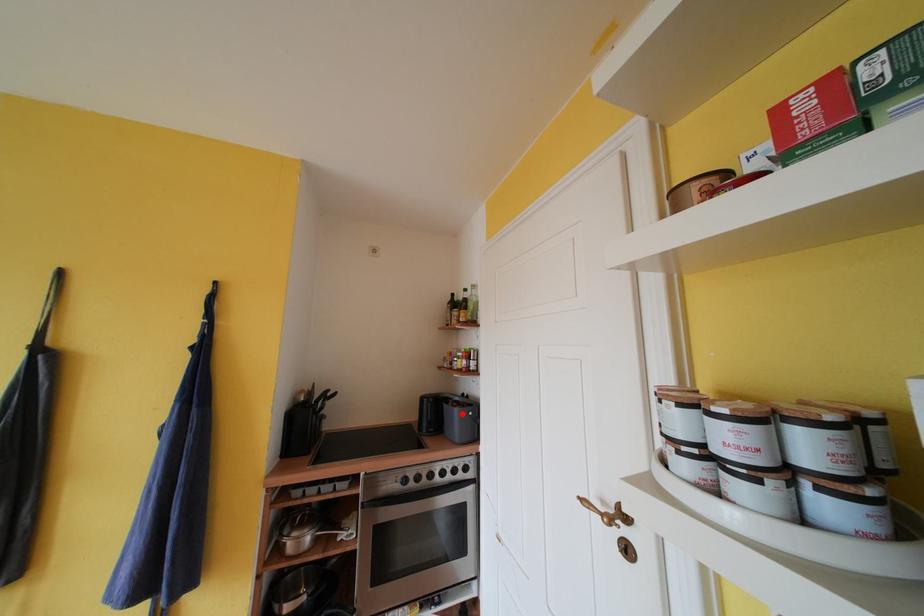
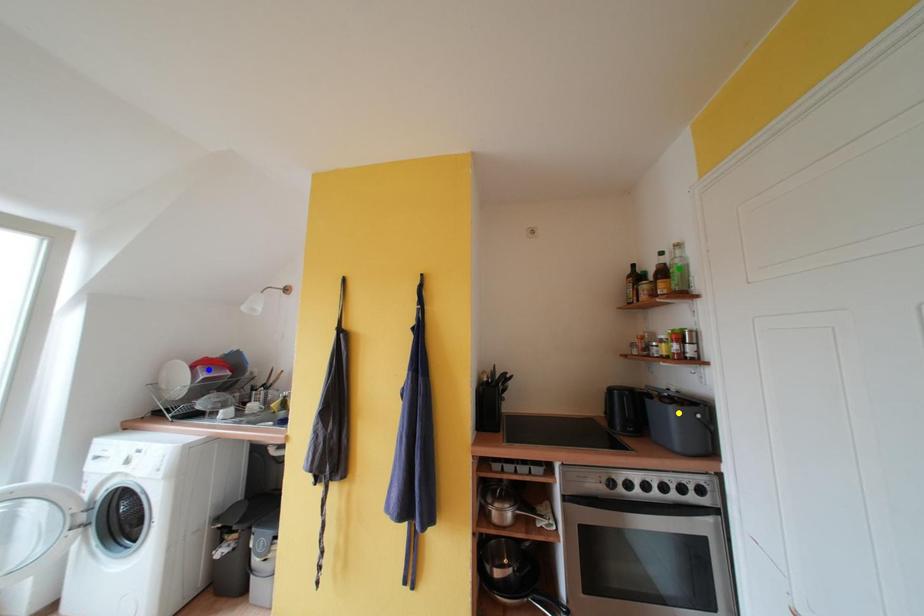
Question: I am providing you with two images of the same scene from different viewpoints. A red point is marked on the first image. You are given multiple points on the second image. Can you choose the point in image 2 that corresponds to the point in image 1?

Choices:
 (A) yellow point
 (B) green point
 (C) blue point

Answer: (A)